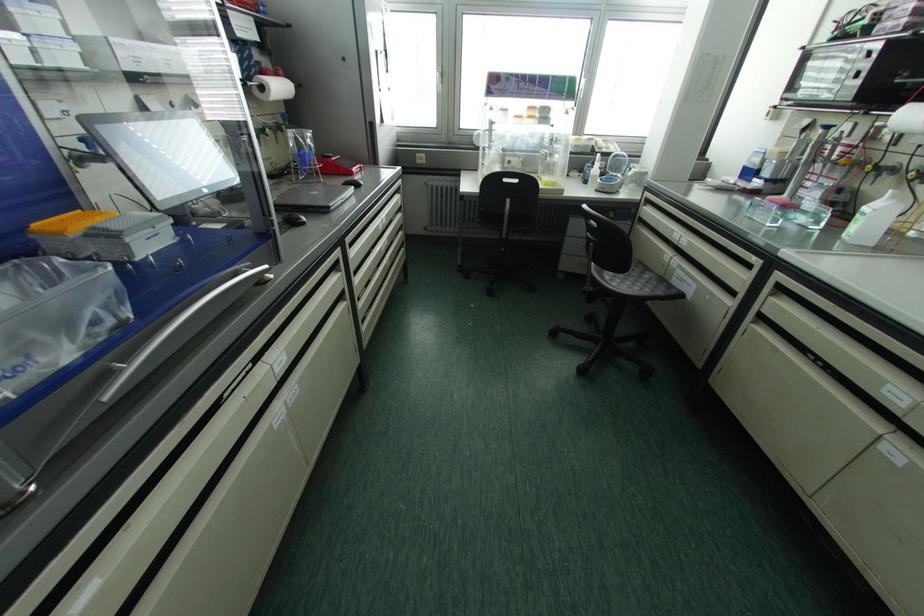
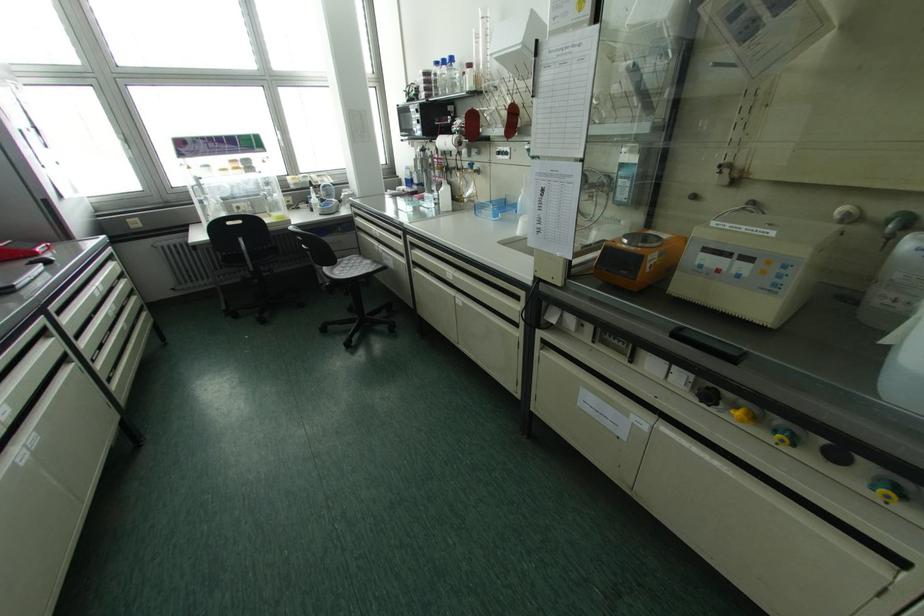
In the second image, find the point that corresponds to (350,172) in the first image.

(35, 254)